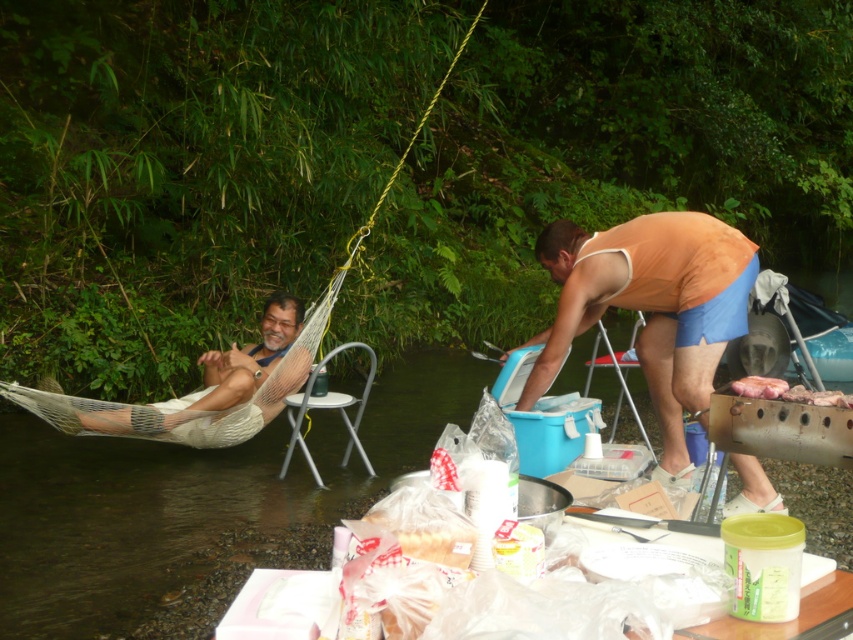
Can you confirm if orange fabric tank top at right is positioned below white metallic chair at center?

No.

Is point (666, 275) positioned before point (289, 435)?

Yes, point (666, 275) is in front of point (289, 435).

The image size is (853, 640). I want to click on orange fabric tank top at right, so click(x=651, y=307).

Where is `white mesh hammock at left`? The image size is (853, 640). white mesh hammock at left is located at coordinates (213, 376).

Looking at this image, who is shorter, white mesh hammock at left or raw meat at right?

raw meat at right

Is point (218, 376) closer to camera compared to point (788, 397)?

No.

The height and width of the screenshot is (640, 853). I want to click on white mesh hammock at left, so click(213, 376).

Who is positioned more to the right, raw meat at right or blue plastic chair at lower right?

From the viewer's perspective, blue plastic chair at lower right appears more on the right side.

Between raw meat at right and blue plastic chair at lower right, which one is positioned lower?

blue plastic chair at lower right

Measure the distance between raw meat at right and camera.

raw meat at right is 2.00 meters away from camera.

This screenshot has width=853, height=640. I want to click on raw meat at right, so pos(787,392).